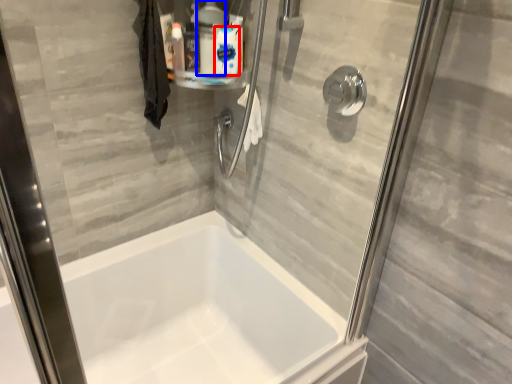
Question: Which object appears closest to the camera in this image, cleaning product (highlighted by a red box) or cleaning product (highlighted by a blue box)?

Choices:
 (A) cleaning product
 (B) cleaning product

Answer: (B)